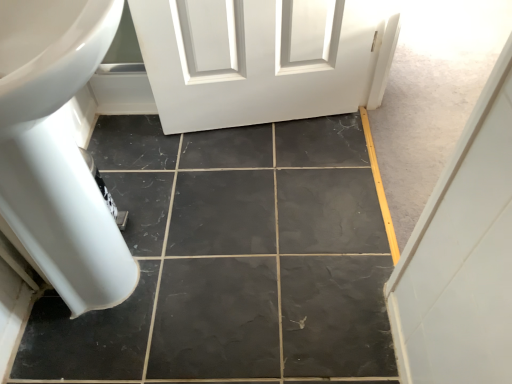
Question: From the image's perspective, is black marble tile at center above or below white glossy bath at left?

Choices:
 (A) above
 (B) below

Answer: (B)

Question: Is black marble tile at center wider or thinner than white glossy bath at left?

Choices:
 (A) wide
 (B) thin

Answer: (A)

Question: Would you say black marble tile at center is to the left or to the right of white glossy bath at left in the picture?

Choices:
 (A) right
 (B) left

Answer: (A)

Question: From a real-world perspective, is white glossy bath at left above or below black marble tile at center?

Choices:
 (A) above
 (B) below

Answer: (A)

Question: Looking at their shapes, would you say white glossy bath at left is wider or thinner than black marble tile at center?

Choices:
 (A) thin
 (B) wide

Answer: (A)

Question: Does point (91, 31) appear closer or farther from the camera than point (247, 301)?

Choices:
 (A) farther
 (B) closer

Answer: (B)

Question: Is white glossy bath at left bigger or smaller than black marble tile at center?

Choices:
 (A) big
 (B) small

Answer: (A)